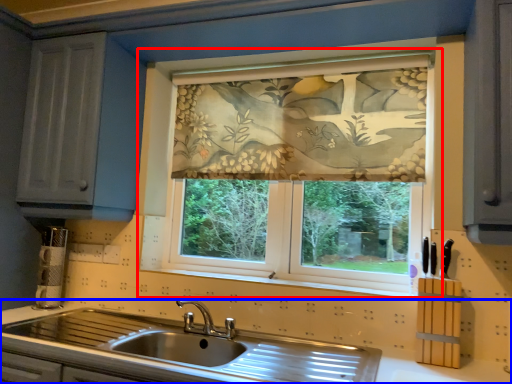
Question: Which of the following is the farthest to the observer, window (highlighted by a red box) or countertop (highlighted by a blue box)?

Choices:
 (A) window
 (B) countertop

Answer: (A)